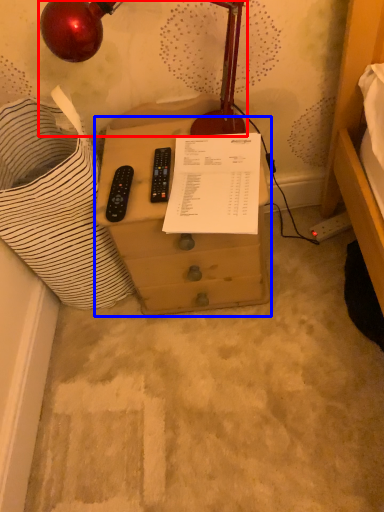
Question: Which object is closer to the camera taking this photo, lamp (highlighted by a red box) or furniture (highlighted by a blue box)?

Choices:
 (A) lamp
 (B) furniture

Answer: (A)